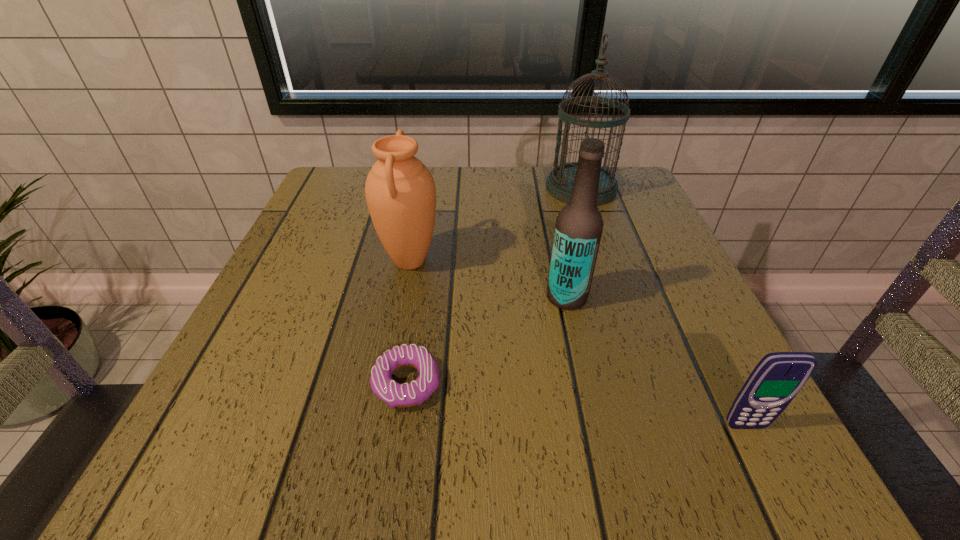
The width and height of the screenshot is (960, 540). I want to click on vacant space located on the front-facing side of the birdcage, so click(477, 188).

Where is `free region located on the side of the second tallest object with the label`? free region located on the side of the second tallest object with the label is located at coordinates (452, 297).

Locate an element on the screen. blank area located 0.190m on the side of the second tallest object with the label is located at coordinates (441, 297).

You are a GUI agent. You are given a task and a screenshot of the screen. Output one action in this format:
    pyautogui.click(x=<x>, y=<y>)
    Task: Click on the blank area located 0.050m on the side of the second tallest object with the label
    
    Given the screenshot: What is the action you would take?
    pyautogui.click(x=518, y=297)

Identify the location of free space located 0.100m on the right of the urn. (492, 261).

Find the location of a particular element. free space located 0.070m on the front-facing side of the nearest object is located at coordinates (774, 482).

Find the location of a particular element. Image resolution: width=960 pixels, height=540 pixels. vacant region located 0.050m on the back of the shortest object is located at coordinates (415, 333).

Find the location of a particular element. This screenshot has width=960, height=540. object that is at the far edge is located at coordinates (559, 183).

The width and height of the screenshot is (960, 540). Identify the location of object that is at the near edge. (778, 377).

The width and height of the screenshot is (960, 540). Identify the location of birdcage that is at the right edge. (559, 183).